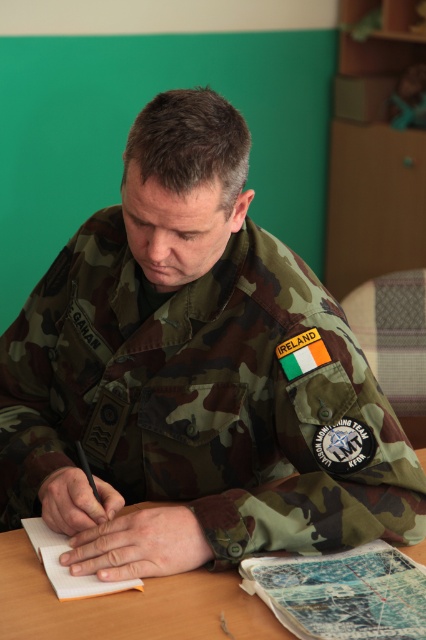
From the picture: You are a photographer positioned to the left of the wooden table at center and white paper notebook at center. Which object is closer to your current position?

The white paper notebook at center is closer to your position because the wooden table at center is to the right of it, placing the notebook between you and the table.

Looking at this image, what is the 2D coordinate of the wooden table at center?

The wooden table at center is located at the 2D coordinate point of (127, 605).